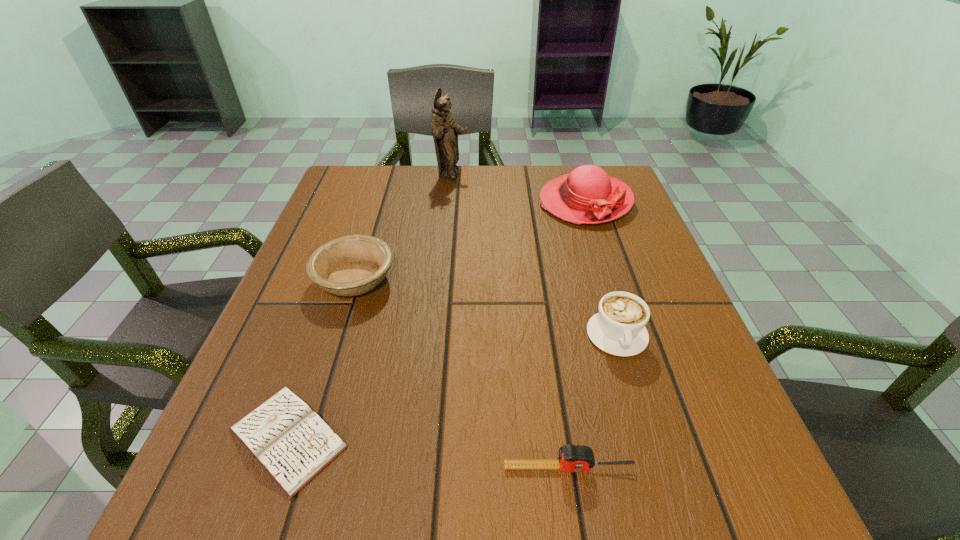
Identify the location of free space between the figurine and the shortest object. Image resolution: width=960 pixels, height=540 pixels. (370, 306).

Identify the location of object that stands as the third closest to the second shortest object. (352, 265).

Find the location of a particular element. Image resolution: width=960 pixels, height=540 pixels. object that is the third closest to the tape measure is located at coordinates (352, 265).

At what (x,y) coordinates should I click in order to perform the action: click on vacant space that satisfies the following two spatial constraints: 1. on the back side of the tape measure; 2. on the front-facing side of the tallest object. Please return your answer as a coordinate pair (x, y). The width and height of the screenshot is (960, 540). Looking at the image, I should click on click(524, 175).

The height and width of the screenshot is (540, 960). What are the coordinates of `blank space that satisfies the following two spatial constraints: 1. on the front-facing side of the third object from left to right; 2. on the right side of the tape measure` in the screenshot? It's located at (423, 468).

Find the location of a particular element. free space that satisfies the following two spatial constraints: 1. on the front-facing side of the figurine; 2. on the left side of the second shortest object is located at coordinates (423, 468).